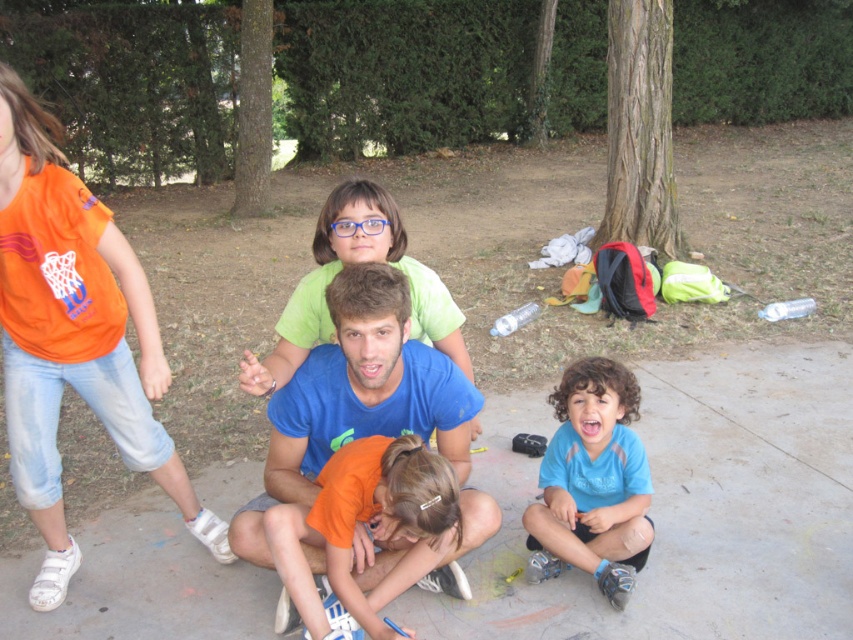
Question: Which object is closer to the camera taking this photo?

Choices:
 (A) green matte shirt at center
 (B) orange cotton shirt at lower center
 (C) orange cotton shirt at left
 (D) blue matte shirt at lower right

Answer: (B)

Question: Among these objects, which one is nearest to the camera?

Choices:
 (A) concrete at center
 (B) blue matte shirt at lower right
 (C) orange cotton shirt at lower center
 (D) green matte shirt at center

Answer: (C)

Question: Is the position of orange cotton shirt at left more distant than that of blue cotton shirt at center?

Choices:
 (A) yes
 (B) no

Answer: (A)

Question: Which point appears closest to the camera in this image?

Choices:
 (A) (49, 432)
 (B) (410, 400)
 (C) (355, 204)

Answer: (B)

Question: Is concrete at center positioned at the back of blue cotton shirt at center?

Choices:
 (A) yes
 (B) no

Answer: (A)

Question: Can you confirm if concrete at center is bigger than orange cotton shirt at lower center?

Choices:
 (A) no
 (B) yes

Answer: (B)